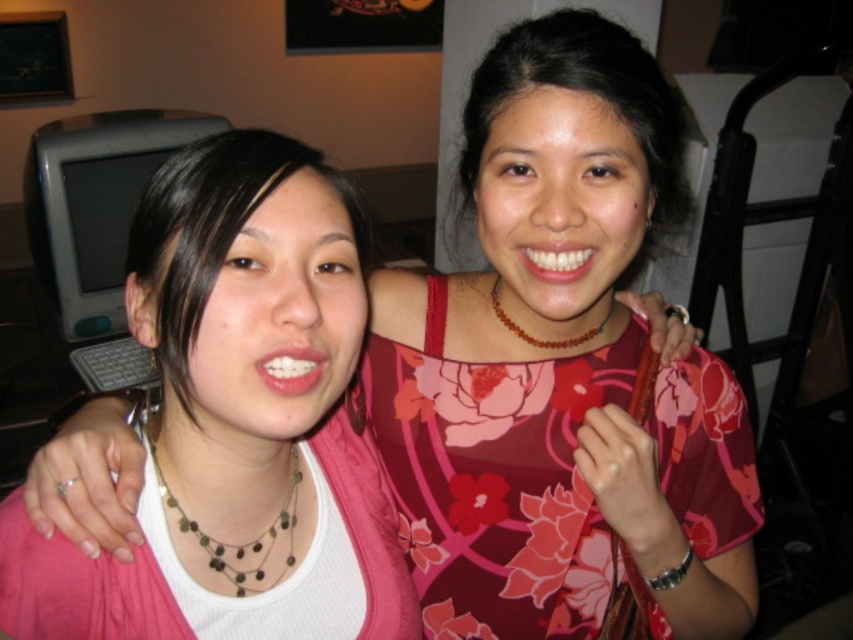
Measure the distance between pink fabric shirt at center and floral print fabric dress at center.

pink fabric shirt at center is 7.46 inches away from floral print fabric dress at center.

Can you confirm if pink fabric shirt at center is positioned to the left of floral print fabric dress at center?

Correct, you'll find pink fabric shirt at center to the left of floral print fabric dress at center.

Is point (280, 609) closer to viewer compared to point (544, 369)?

That is True.

The height and width of the screenshot is (640, 853). Identify the location of pink fabric shirt at center. (236, 422).

Can you confirm if floral print fabric dress at center is bigger than brown leather necklace at upper center?

Correct, floral print fabric dress at center is larger in size than brown leather necklace at upper center.

Image resolution: width=853 pixels, height=640 pixels. Find the location of `floral print fabric dress at center`. floral print fabric dress at center is located at coordinates (496, 480).

Is point (482, 589) less distant than point (496, 312)?

No, it is not.

Identify the location of floral print fabric dress at center. This screenshot has height=640, width=853. (496, 480).

Is pink fabric shirt at center in front of green stone necklace at center?

Yes, it is.

Can you confirm if pink fabric shirt at center is smaller than green stone necklace at center?

No, pink fabric shirt at center is not smaller than green stone necklace at center.

The height and width of the screenshot is (640, 853). What do you see at coordinates (236, 422) in the screenshot?
I see `pink fabric shirt at center` at bounding box center [236, 422].

Where is `pink fabric shirt at center`? The width and height of the screenshot is (853, 640). pink fabric shirt at center is located at coordinates point(236,422).